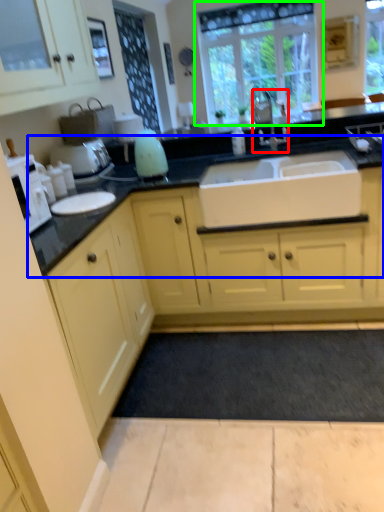
Question: Which is nearer to the tap (highlighted by a red box)? countertop (highlighted by a blue box) or window (highlighted by a green box).

Choices:
 (A) countertop
 (B) window

Answer: (A)